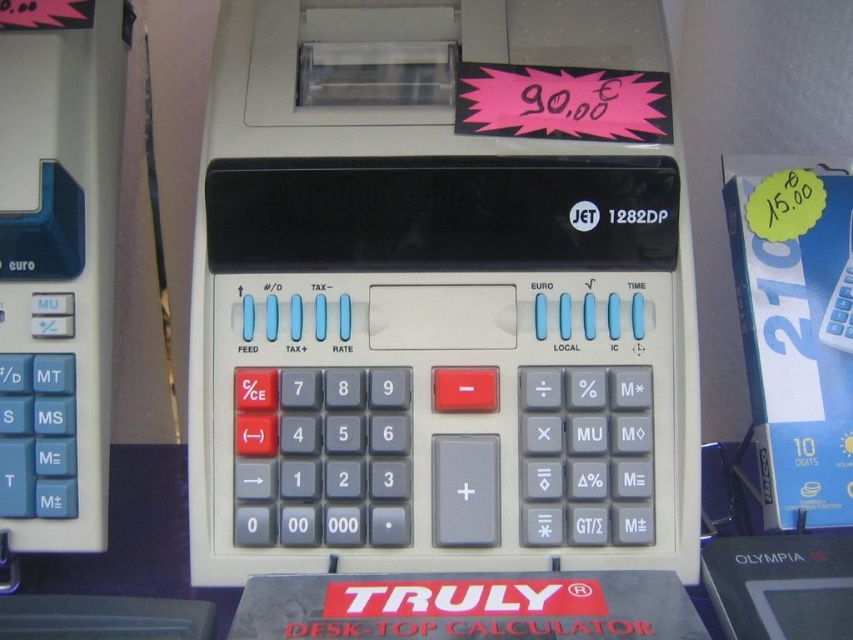
Question: Does beige plastic calculator at center have a larger size compared to white plastic calculator at center?

Choices:
 (A) yes
 (B) no

Answer: (A)

Question: Which point is farther to the camera?

Choices:
 (A) (488, 541)
 (B) (850, 234)

Answer: (B)

Question: Which object appears closest to the camera in this image?

Choices:
 (A) beige plastic calculator at center
 (B) white plastic calculator at center

Answer: (A)

Question: In this image, where is beige plastic calculator at center located relative to white plastic calculator at center?

Choices:
 (A) above
 (B) below

Answer: (A)

Question: Is beige plastic calculator at center bigger than white plastic calculator at center?

Choices:
 (A) no
 (B) yes

Answer: (B)